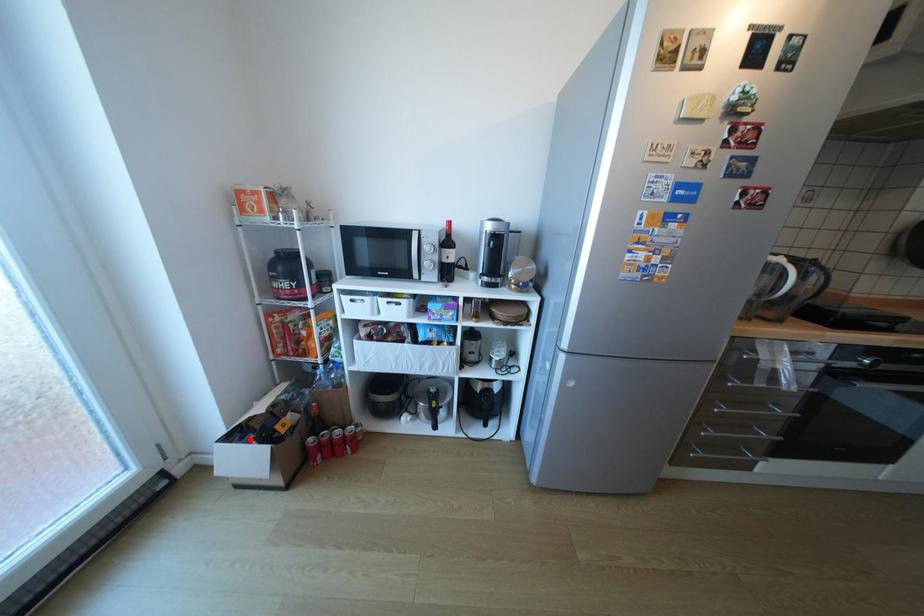
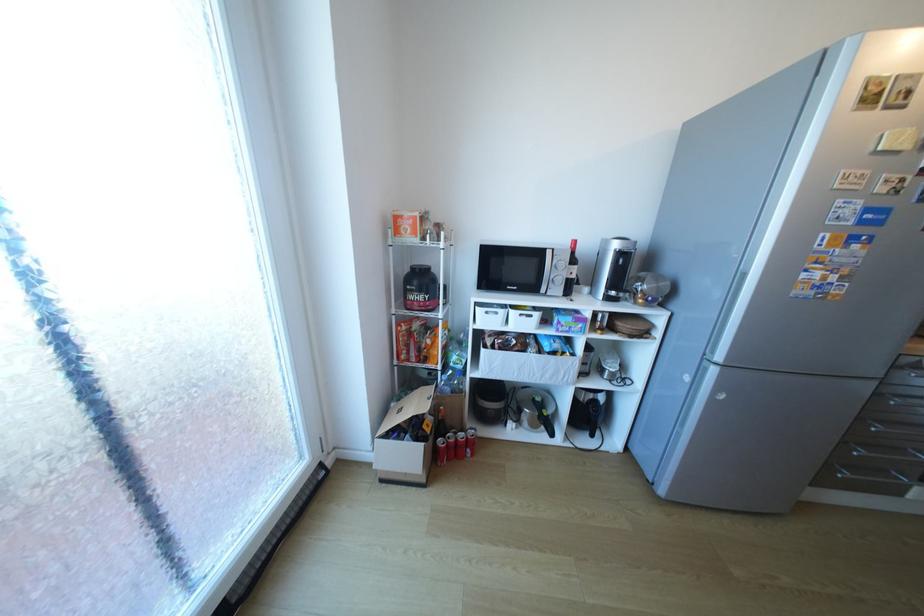
Question: I am providing you with two images of the same scene from different viewpoints. A red point is shown in image1. For the corresponding object point in image2, is it positioned nearer or farther from the camera?

Choices:
 (A) Nearer
 (B) Farther

Answer: (B)